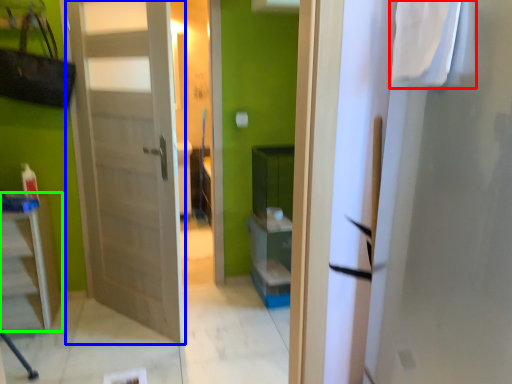
Question: Considering the real-world distances, which object is farthest from laundry (highlighted by a red box)? door (highlighted by a blue box) or furniture (highlighted by a green box)?

Choices:
 (A) door
 (B) furniture

Answer: (B)